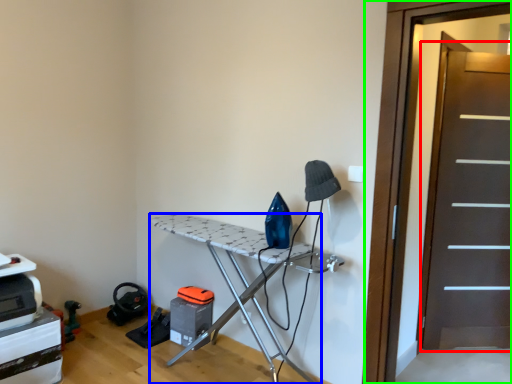
Question: Which object is the farthest from screen door (highlighted by a red box)? Choose among these: furniture (highlighted by a blue box) or screen door (highlighted by a green box).

Choices:
 (A) furniture
 (B) screen door

Answer: (A)